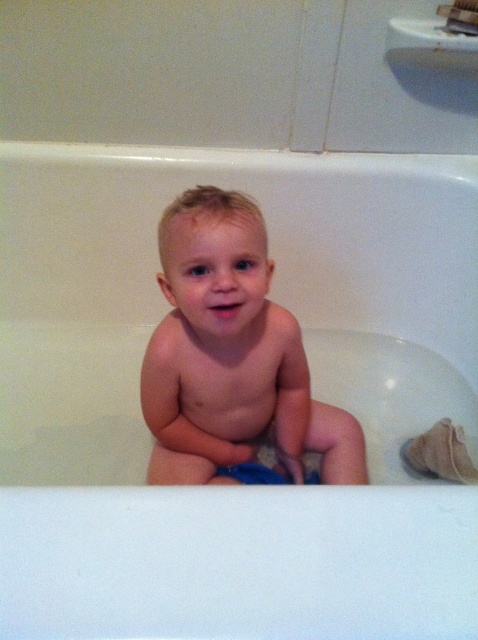
Question: From the image, what is the correct spatial relationship of smooth skin baby at center in relation to blue fabric diaper at center?

Choices:
 (A) right
 (B) left

Answer: (B)

Question: Among these objects, which one is nearest to the camera?

Choices:
 (A) blue fabric diaper at center
 (B) smooth skin baby at center

Answer: (B)

Question: Among these objects, which one is farthest from the camera?

Choices:
 (A) blue fabric diaper at center
 (B) smooth skin baby at center

Answer: (A)

Question: Does smooth skin baby at center come in front of blue fabric diaper at center?

Choices:
 (A) no
 (B) yes

Answer: (B)

Question: Where is smooth skin baby at center located in relation to blue fabric diaper at center in the image?

Choices:
 (A) below
 (B) above

Answer: (B)

Question: Which of the following is the closest to the observer?

Choices:
 (A) (150, 340)
 (B) (259, 481)

Answer: (A)